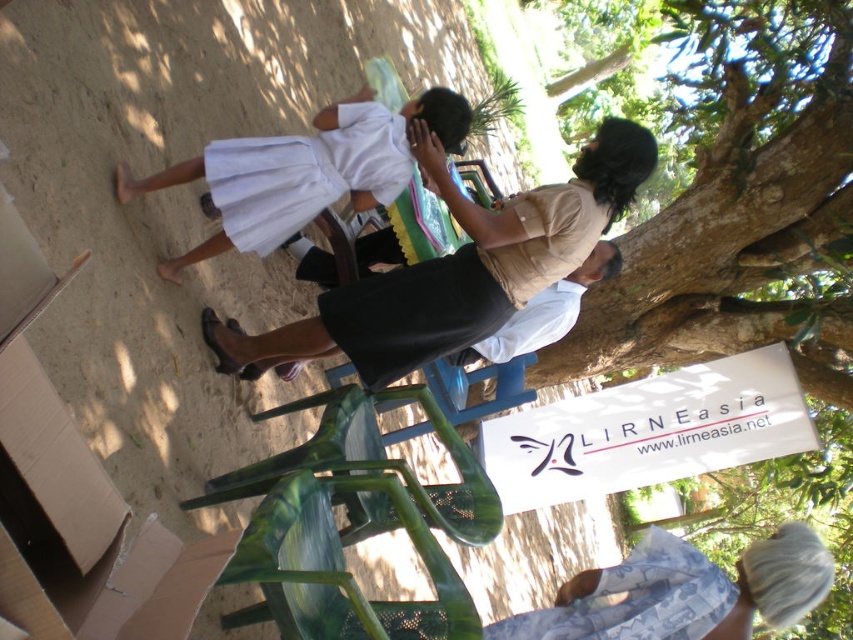
Is matte beige blouse at upper center smaller than white cotton dress at center?

Actually, matte beige blouse at upper center might be larger than white cotton dress at center.

Describe the element at coordinates (456, 268) in the screenshot. Image resolution: width=853 pixels, height=640 pixels. I see `matte beige blouse at upper center` at that location.

Describe the element at coordinates (456, 268) in the screenshot. I see `matte beige blouse at upper center` at that location.

Locate an element on the screen. The height and width of the screenshot is (640, 853). matte beige blouse at upper center is located at coordinates (456, 268).

Is point (653, 385) more distant than point (296, 202)?

Yes, it is behind point (296, 202).

Does white paper sign at center have a lesser width compared to white cotton dress at center?

Incorrect, white paper sign at center's width is not less than white cotton dress at center's.

Looking at this image, who is more forward, (x=514, y=438) or (x=251, y=144)?

Point (x=251, y=144)

Identify the location of white paper sign at center. (648, 432).

Does matte beige blouse at upper center have a lesser height compared to white fabric skirt at left?

In fact, matte beige blouse at upper center may be taller than white fabric skirt at left.

Which is in front, point (387, 282) or point (363, 193)?

Point (387, 282) is more forward.

Locate an element on the screen. The image size is (853, 640). matte beige blouse at upper center is located at coordinates (456, 268).